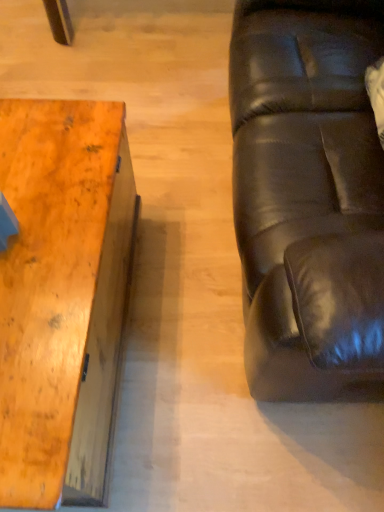
Question: Does black leather couch at right appear on the right side of wooden table at left?

Choices:
 (A) no
 (B) yes

Answer: (B)

Question: Does black leather couch at right have a lesser height compared to wooden table at left?

Choices:
 (A) yes
 (B) no

Answer: (B)

Question: Can you confirm if black leather couch at right is taller than wooden table at left?

Choices:
 (A) no
 (B) yes

Answer: (B)

Question: Is black leather couch at right positioned beyond the bounds of wooden table at left?

Choices:
 (A) no
 (B) yes

Answer: (B)

Question: From the image's perspective, is black leather couch at right under wooden table at left?

Choices:
 (A) no
 (B) yes

Answer: (A)

Question: From the image's perspective, does black leather couch at right appear higher than wooden table at left?

Choices:
 (A) no
 (B) yes

Answer: (B)

Question: Is wooden table at left bigger than black leather couch at right?

Choices:
 (A) yes
 (B) no

Answer: (B)

Question: Considering the relative sizes of wooden table at left and black leather couch at right in the image provided, is wooden table at left taller than black leather couch at right?

Choices:
 (A) yes
 (B) no

Answer: (B)

Question: Can you confirm if wooden table at left is positioned to the left of black leather couch at right?

Choices:
 (A) yes
 (B) no

Answer: (A)

Question: Can you confirm if wooden table at left is wider than black leather couch at right?

Choices:
 (A) yes
 (B) no

Answer: (B)

Question: From the image's perspective, is wooden table at left located beneath black leather couch at right?

Choices:
 (A) no
 (B) yes

Answer: (B)

Question: From a real-world perspective, is wooden table at left positioned under black leather couch at right based on gravity?

Choices:
 (A) yes
 (B) no

Answer: (A)

Question: Based on their positions, is black leather couch at right located to the left or right of wooden table at left?

Choices:
 (A) right
 (B) left

Answer: (A)